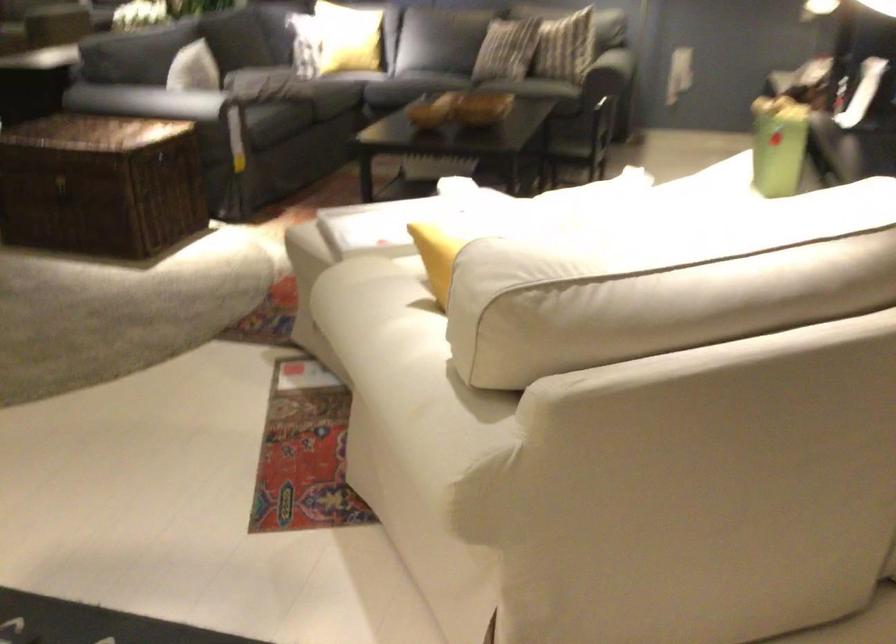
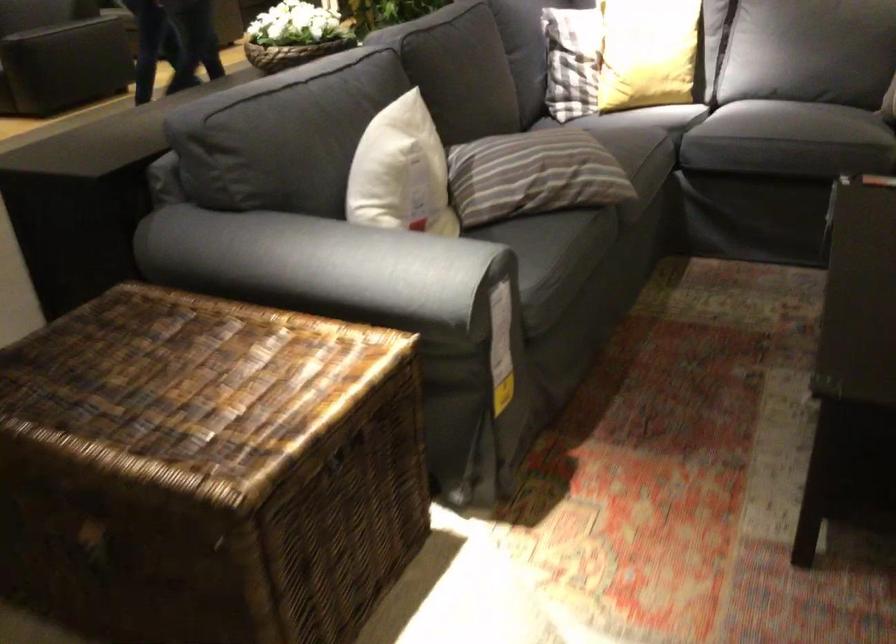
Locate, in the second image, the point that corresponds to pixel 150 96 in the first image.

(304, 265)